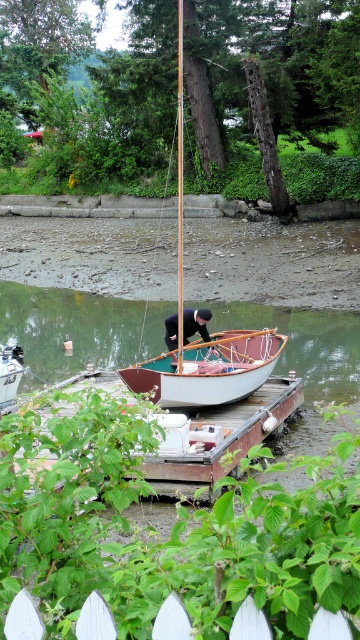
Is wooden dock at center taller than white wooden boat at center?

Yes, wooden dock at center is taller than white wooden boat at center.

Who is taller, wooden dock at center or white wooden boat at center?

wooden dock at center

Describe the element at coordinates (219, 438) in the screenshot. I see `wooden dock at center` at that location.

Find the location of a particular element. Image resolution: width=360 pixels, height=640 pixels. wooden dock at center is located at coordinates (219, 438).

Consider the image. Which of these two, wooden dock at center or wooden sailboat at center, stands taller?

Standing taller between the two is wooden sailboat at center.

Who is positioned more to the right, wooden dock at center or wooden sailboat at center?

wooden dock at center

Image resolution: width=360 pixels, height=640 pixels. What do you see at coordinates (219, 438) in the screenshot? I see `wooden dock at center` at bounding box center [219, 438].

Where is `wooden dock at center`? The height and width of the screenshot is (640, 360). wooden dock at center is located at coordinates (219, 438).

Is wooden sailboat at center thinner than white wooden picket fence at lower center?

In fact, wooden sailboat at center might be wider than white wooden picket fence at lower center.

Locate an element on the screen. wooden sailboat at center is located at coordinates (200, 339).